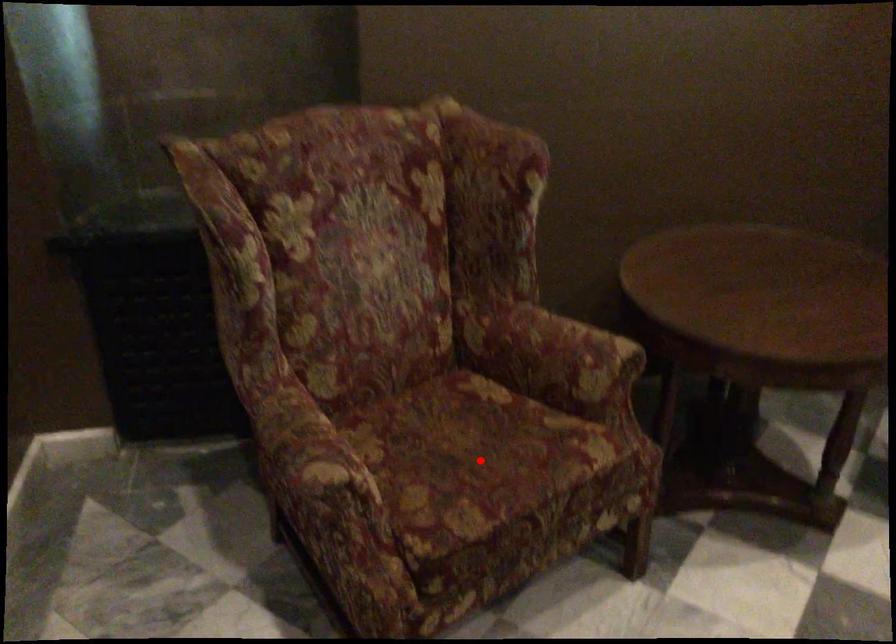
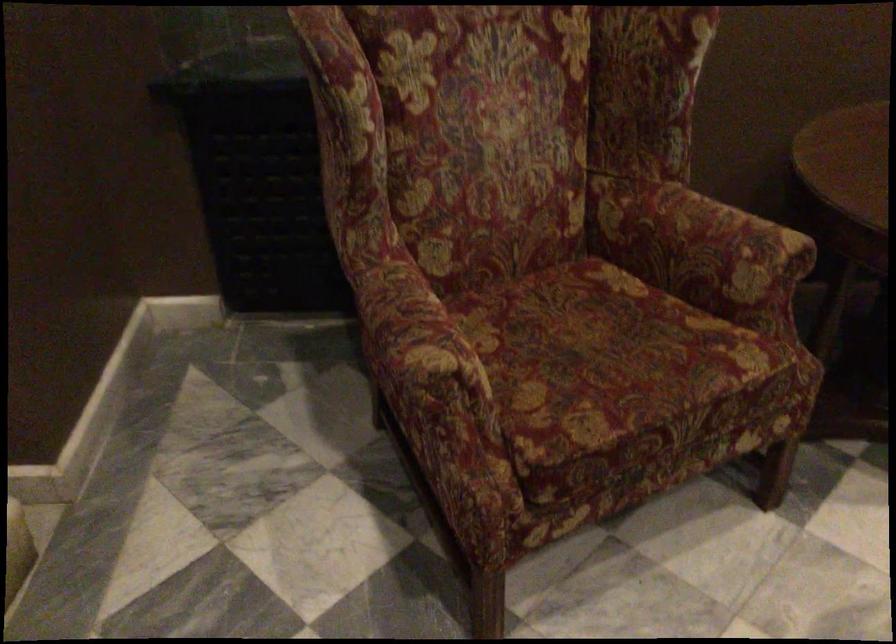
Question: I am providing you with two images of the same scene from different viewpoints. Image1 has a red point marked. In image2, the corresponding 3D location appears at what relative position? Reply with the corresponding letter.

Choices:
 (A) Closer
 (B) Farther

Answer: (A)